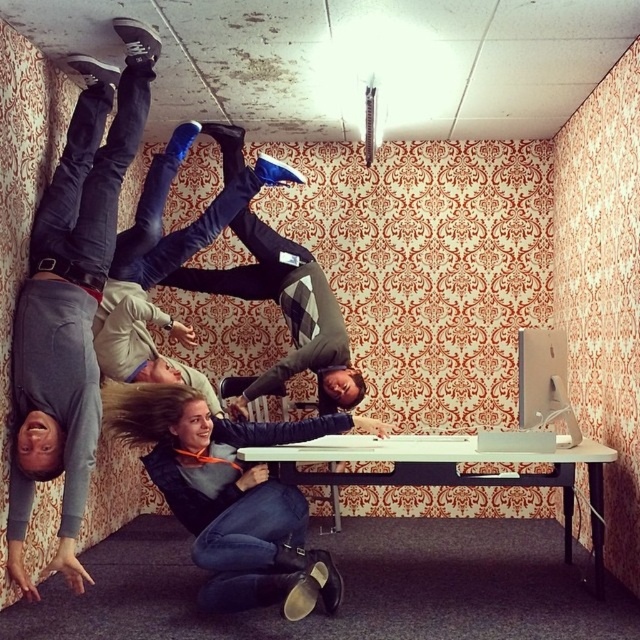
What do you see at coordinates (72, 300) in the screenshot? The width and height of the screenshot is (640, 640). I see `gray matte pants at lower left` at bounding box center [72, 300].

Does point (84, 189) lie behind point (371, 445)?

No, (84, 189) is closer to viewer.

This screenshot has height=640, width=640. Find the location of `gray matte pants at lower left`. gray matte pants at lower left is located at coordinates (72, 300).